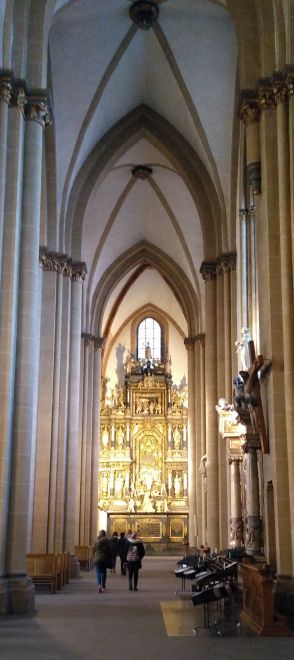
Image resolution: width=294 pixels, height=660 pixels. I want to click on pillar, so click(15, 531).